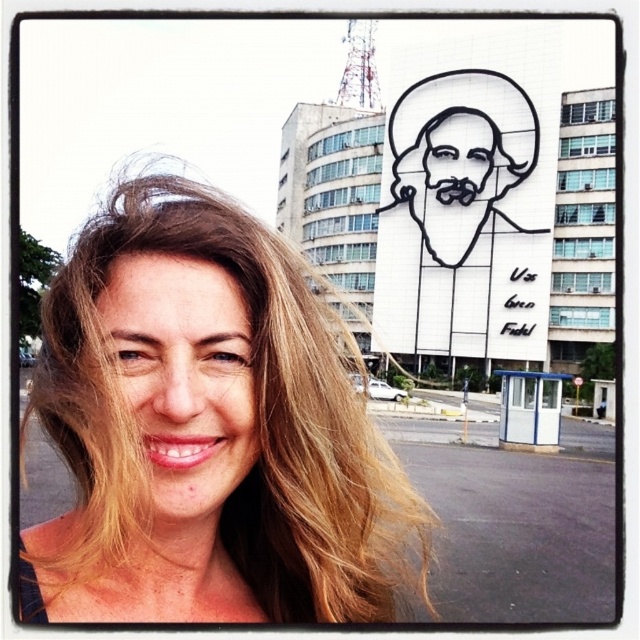
You are a photographer trying to capture the black outline mural at upper center in your shot. Based on the scene description, where should you position your camera to ensure the mural is centered in the frame?

To center the black outline mural at upper center in your frame, position your camera so that the mural is located at the coordinates 0.320 on the x axis and 0.708 on the y axis, as specified in the scene description.

Based on the photo, you are taking a photo of the building with the black outline mural at upper center. The camera you are using has a rectangular viewfinder with a 0.5x zoom. To ensure the entire black outline mural at upper center fits within the viewfinder, where should you position the point at point coordinates [452,204]?

The point at coordinates [452,204] represents the black outline mural at upper center. To ensure the entire black outline mural at upper center fits within the viewfinder, you should position the point at coordinates [452,204] at the center of the viewfinder and adjust the zoom accordingly.